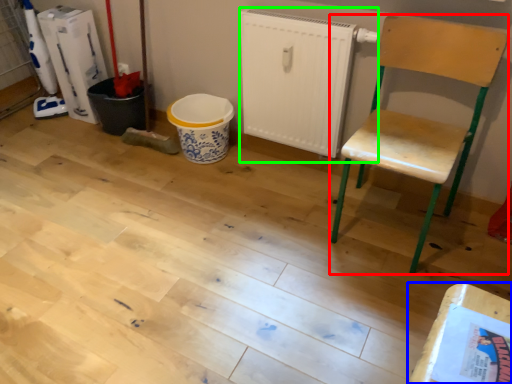
Question: Which object is the closest to the chair (highlighted by a red box)? Choose among these: table (highlighted by a blue box) or radiator (highlighted by a green box).

Choices:
 (A) table
 (B) radiator

Answer: (B)